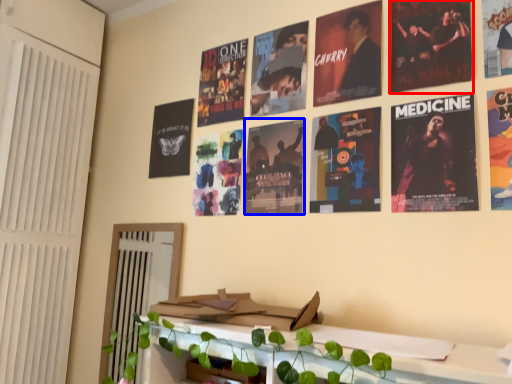
Question: Which object appears closest to the camera in this image, poster (highlighted by a red box) or poster (highlighted by a blue box)?

Choices:
 (A) poster
 (B) poster

Answer: (A)